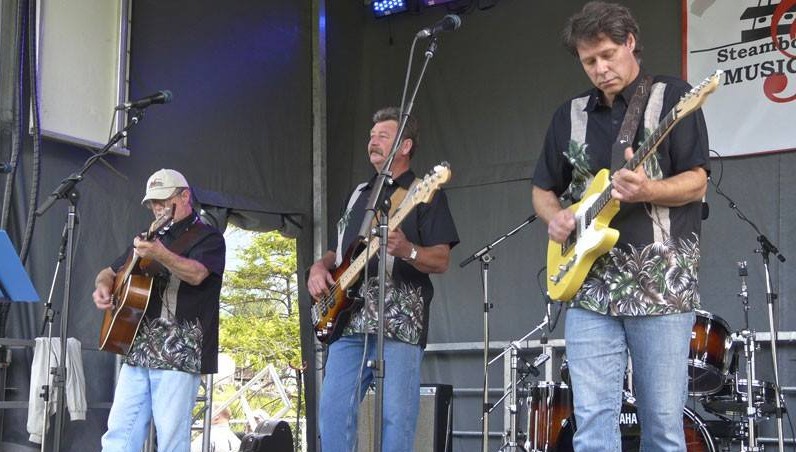
Image resolution: width=796 pixels, height=452 pixels. Find the location of `stand`. stand is located at coordinates click(x=427, y=63).